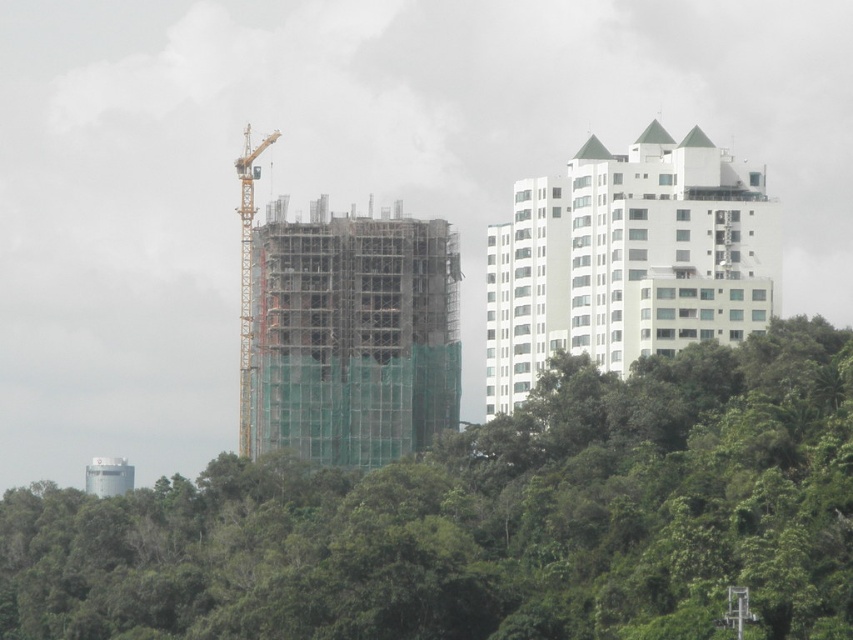
Question: Which point is closer to the camera?

Choices:
 (A) white smooth building at upper right
 (B) green leafy trees at center
 (C) scaffolding wood at center
 (D) yellow metallic crane at center-left

Answer: (B)

Question: Which object is the closest to the white smooth building at upper right?

Choices:
 (A) scaffolding wood at center
 (B) green leafy trees at center
 (C) white matte water tower at lower left
 (D) yellow metallic crane at center-left

Answer: (B)

Question: Can you confirm if green leafy trees at center is positioned below scaffolding wood at center?

Choices:
 (A) no
 (B) yes

Answer: (B)

Question: Is scaffolding wood at center to the right of white matte water tower at lower left from the viewer's perspective?

Choices:
 (A) no
 (B) yes

Answer: (B)

Question: Which object is closer to the camera taking this photo?

Choices:
 (A) white smooth building at upper right
 (B) white matte water tower at lower left
 (C) yellow metallic crane at center-left
 (D) scaffolding wood at center

Answer: (A)

Question: Where is scaffolding wood at center located in relation to white matte water tower at lower left in the image?

Choices:
 (A) above
 (B) below

Answer: (A)